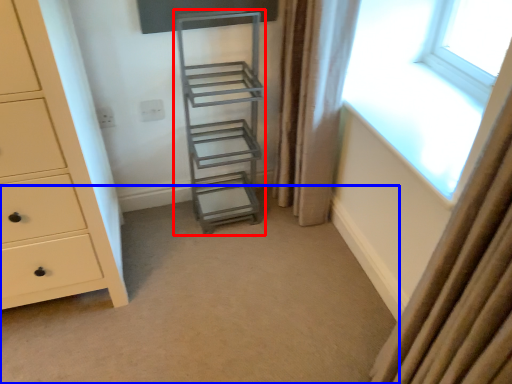
Question: Which of the following is the farthest to the observer, shelf (highlighted by a red box) or plain (highlighted by a blue box)?

Choices:
 (A) shelf
 (B) plain

Answer: (A)